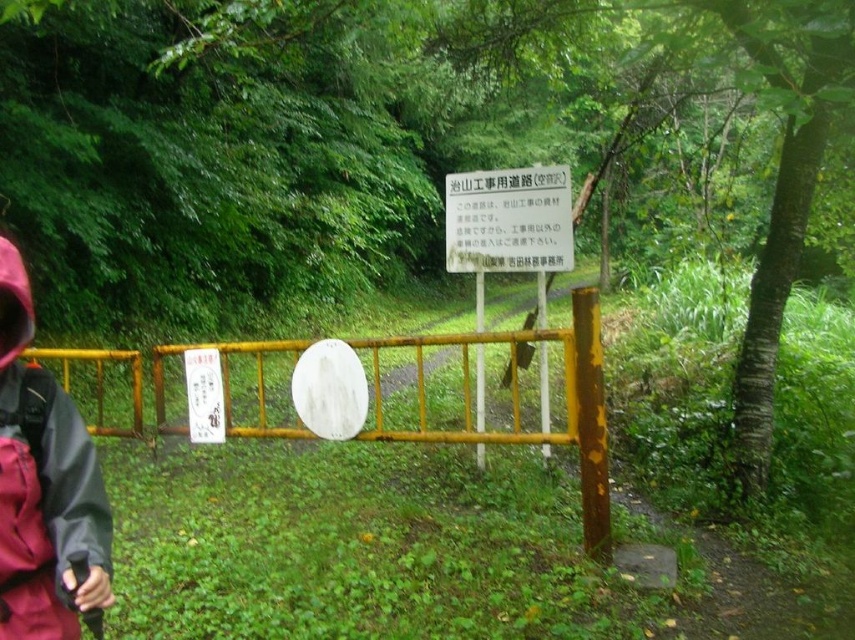
Does red waterproof jacket at left lie in front of white paper sign at center?

That is True.

Does red waterproof jacket at left appear under white paper sign at center?

Indeed, red waterproof jacket at left is positioned under white paper sign at center.

Identify the location of red waterproof jacket at left. (43, 484).